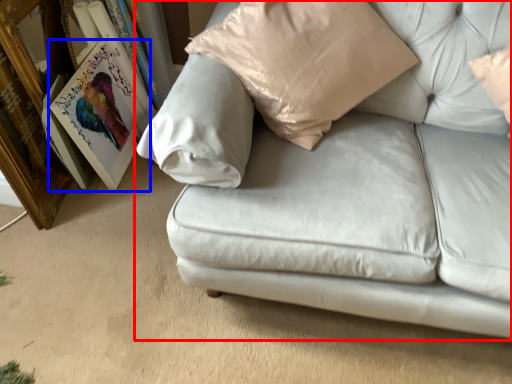
Question: Which point is closer to the camera, studio couch (highlighted by a red box) or picture frame (highlighted by a blue box)?

Choices:
 (A) studio couch
 (B) picture frame

Answer: (A)